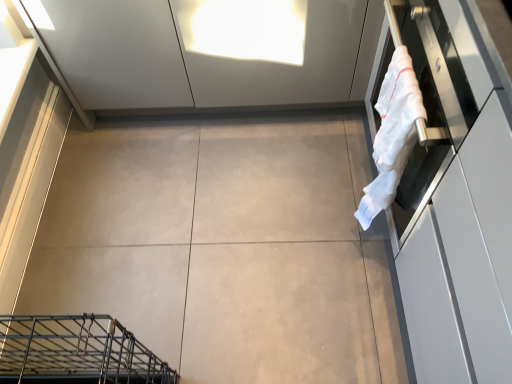
Question: From the image's perspective, is white glossy oven at right under white cotton towel at right?

Choices:
 (A) no
 (B) yes

Answer: (B)

Question: Is white glossy oven at right wider than white cotton towel at right?

Choices:
 (A) yes
 (B) no

Answer: (A)

Question: Is white glossy oven at right oriented away from white cotton towel at right?

Choices:
 (A) no
 (B) yes

Answer: (A)

Question: Does white glossy oven at right contain white cotton towel at right?

Choices:
 (A) no
 (B) yes

Answer: (A)

Question: Is white glossy oven at right taller than white cotton towel at right?

Choices:
 (A) yes
 (B) no

Answer: (A)

Question: Is point (253, 327) positioned closer to the camera than point (485, 66)?

Choices:
 (A) farther
 (B) closer

Answer: (A)

Question: From the image's perspective, relative to white glossy oven at right, is gray matte concrete at center above or below?

Choices:
 (A) below
 (B) above

Answer: (B)

Question: From a real-world perspective, is gray matte concrete at center positioned above or below white glossy oven at right?

Choices:
 (A) below
 (B) above

Answer: (A)

Question: Based on their sizes in the image, would you say gray matte concrete at center is bigger or smaller than white glossy oven at right?

Choices:
 (A) small
 (B) big

Answer: (A)

Question: Relative to white cotton towel at right, is gray matte concrete at center in front or behind?

Choices:
 (A) front
 (B) behind

Answer: (B)

Question: In terms of width, does gray matte concrete at center look wider or thinner when compared to white cotton towel at right?

Choices:
 (A) thin
 (B) wide

Answer: (B)

Question: Which is correct: gray matte concrete at center is inside white cotton towel at right, or outside of it?

Choices:
 (A) outside
 (B) inside

Answer: (A)

Question: From a real-world perspective, is gray matte concrete at center above or below white cotton towel at right?

Choices:
 (A) below
 (B) above

Answer: (A)

Question: Is point (389, 102) closer or farther from the camera than point (493, 195)?

Choices:
 (A) farther
 (B) closer

Answer: (A)

Question: Do you think white cotton towel at right is within white glossy oven at right, or outside of it?

Choices:
 (A) inside
 (B) outside

Answer: (B)